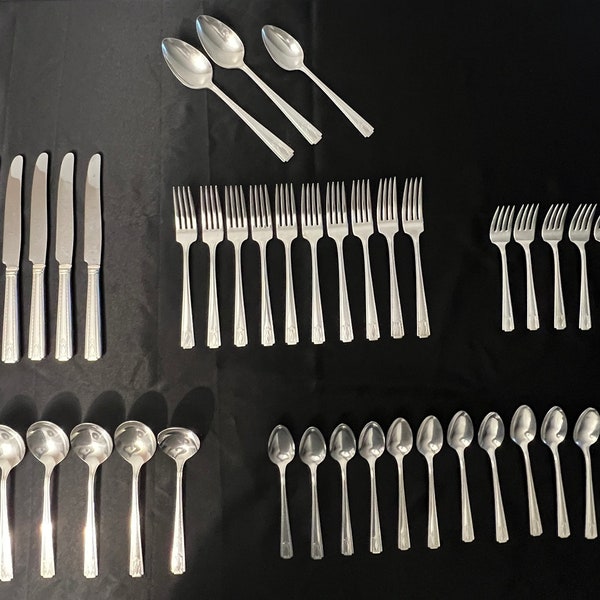
Where is `soup spoons`? This screenshot has height=600, width=600. soup spoons is located at coordinates (179, 447), (138, 439), (104, 442), (40, 448), (5, 457).